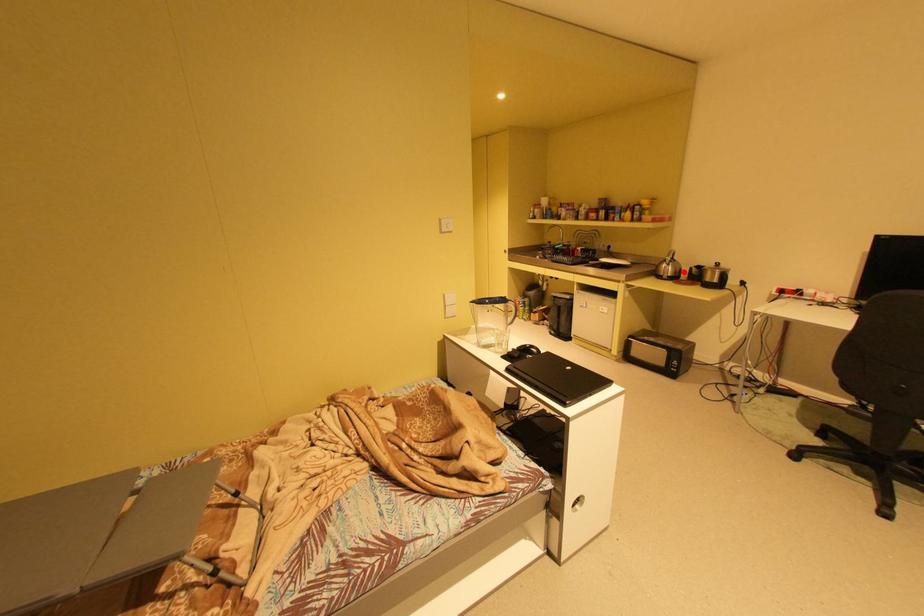
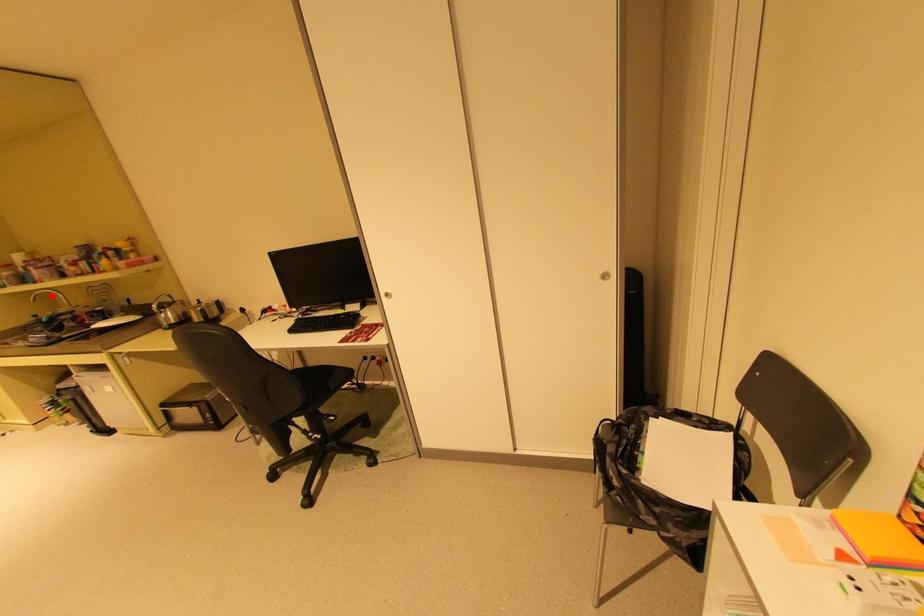
I am providing you with two images of the same scene from different viewpoints. A red point is marked on the first image and another point is marked on the second image. Does the point marked in image1 correspond to the same location as the one in image2?

No